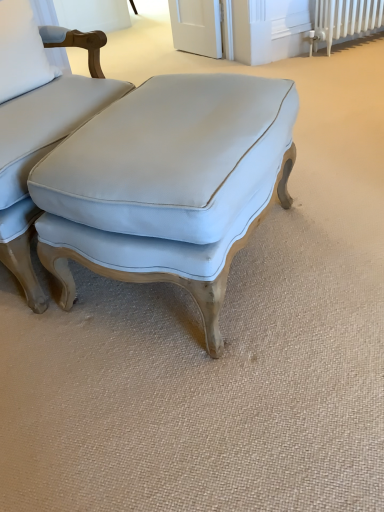
Question: From a real-world perspective, is white fabric pillow at upper left positioned above or below light blue fabric ottoman at center?

Choices:
 (A) above
 (B) below

Answer: (A)

Question: Is point (39, 83) positioned closer to the camera than point (110, 217)?

Choices:
 (A) closer
 (B) farther

Answer: (B)

Question: Which of these objects is positioned farthest from the matte white cushion at center?

Choices:
 (A) white painted metal radiator at upper right
 (B) light blue fabric ottoman at center
 (C) white fabric pillow at upper left

Answer: (A)

Question: Which object is the farthest from the white fabric pillow at upper left?

Choices:
 (A) white painted metal radiator at upper right
 (B) matte white cushion at center
 (C) light blue fabric ottoman at center

Answer: (A)